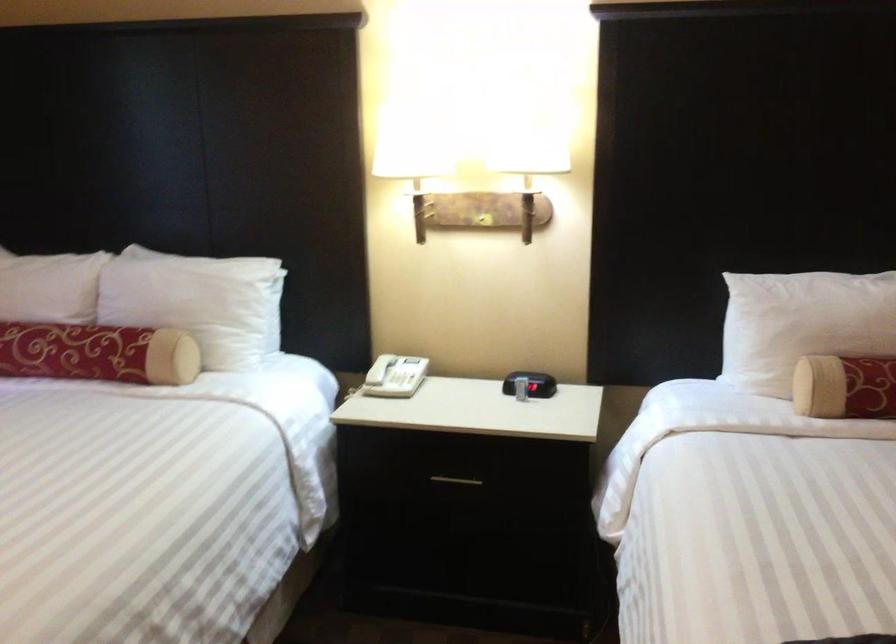
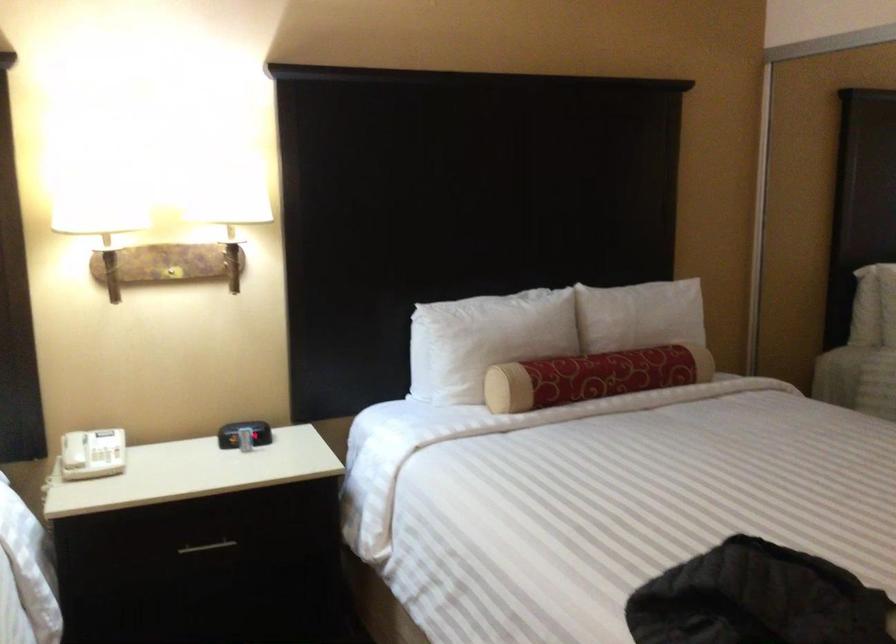
Question: The camera is either moving clockwise (left) or counter-clockwise (right) around the object. The first image is from the beginning of the video and the second image is from the end. Is the camera moving left or right when shooting the video?

Choices:
 (A) Left
 (B) Right

Answer: (A)